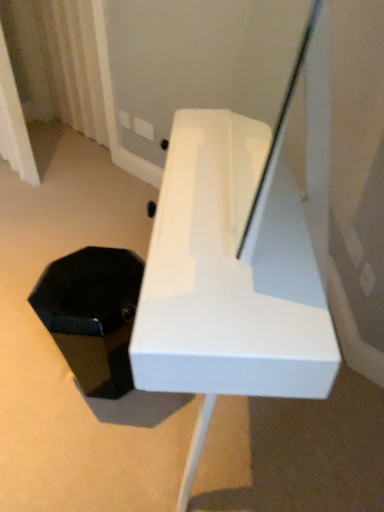
Question: Does white sheer curtain at upper left have a greater width compared to black matte hexagonal box at lower left?

Choices:
 (A) yes
 (B) no

Answer: (B)

Question: From the image's perspective, is white sheer curtain at upper left located above black matte hexagonal box at lower left?

Choices:
 (A) no
 (B) yes

Answer: (B)

Question: From a real-world perspective, is white sheer curtain at upper left located higher than black matte hexagonal box at lower left?

Choices:
 (A) yes
 (B) no

Answer: (A)

Question: Are white sheer curtain at upper left and black matte hexagonal box at lower left beside each other?

Choices:
 (A) no
 (B) yes

Answer: (A)

Question: From a real-world perspective, does white sheer curtain at upper left sit lower than black matte hexagonal box at lower left?

Choices:
 (A) yes
 (B) no

Answer: (B)

Question: Is white sheer curtain at upper left to the right of black matte hexagonal box at lower left from the viewer's perspective?

Choices:
 (A) yes
 (B) no

Answer: (B)

Question: Is white sheer curtain at upper left oriented away from white glossy bench at center?

Choices:
 (A) yes
 (B) no

Answer: (B)

Question: Is white sheer curtain at upper left facing towards white glossy bench at center?

Choices:
 (A) yes
 (B) no

Answer: (B)

Question: From the image's perspective, is white sheer curtain at upper left on top of white glossy bench at center?

Choices:
 (A) yes
 (B) no

Answer: (A)

Question: Considering the relative sizes of white sheer curtain at upper left and white glossy bench at center in the image provided, is white sheer curtain at upper left taller than white glossy bench at center?

Choices:
 (A) yes
 (B) no

Answer: (A)

Question: Can you confirm if white sheer curtain at upper left is positioned to the left of white glossy bench at center?

Choices:
 (A) no
 (B) yes

Answer: (B)

Question: Can you confirm if white sheer curtain at upper left is bigger than white glossy bench at center?

Choices:
 (A) yes
 (B) no

Answer: (B)

Question: Is black matte hexagonal box at lower left smaller than white glossy bench at center?

Choices:
 (A) no
 (B) yes

Answer: (B)